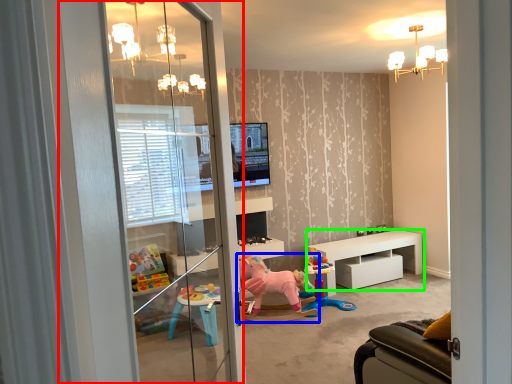
Question: Based on their relative distances, which object is farther from screen door (highlighted by a red box)? Choose from toy (highlighted by a blue box) and table (highlighted by a green box).

Choices:
 (A) toy
 (B) table

Answer: (B)